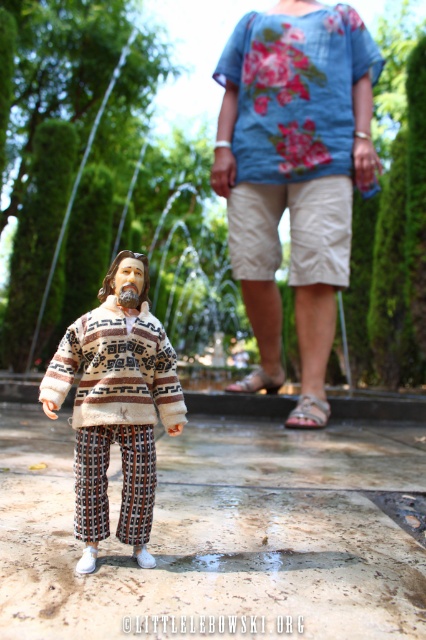
Between knitted wool sweater at center and blue floral fabric shirt at upper center, which one has less height?

With less height is knitted wool sweater at center.

Between point (169, 422) and point (229, 45), which one is positioned behind?

The point (229, 45) is behind.

Which is behind, point (83, 401) or point (347, 170)?

Positioned behind is point (347, 170).

Image resolution: width=426 pixels, height=640 pixels. Identify the location of knitted wool sweater at center. (115, 404).

Between floral cotton shirt at upper center and blue floral fabric shirt at upper center, which one has less height?

blue floral fabric shirt at upper center

Does floral cotton shirt at upper center have a lesser height compared to blue floral fabric shirt at upper center?

No, floral cotton shirt at upper center is not shorter than blue floral fabric shirt at upper center.

Locate an element on the screen. The width and height of the screenshot is (426, 640). floral cotton shirt at upper center is located at coordinates (294, 173).

Locate an element on the screen. floral cotton shirt at upper center is located at coordinates (294, 173).

Can you confirm if floral cotton shirt at upper center is smaller than knitted wool sweater at center?

No, floral cotton shirt at upper center is not smaller than knitted wool sweater at center.

Who is positioned more to the left, floral cotton shirt at upper center or knitted wool sweater at center?

knitted wool sweater at center

At what (x,y) coordinates should I click in order to perform the action: click on floral cotton shirt at upper center. Please return your answer as a coordinate pair (x, y). Looking at the image, I should click on (x=294, y=173).